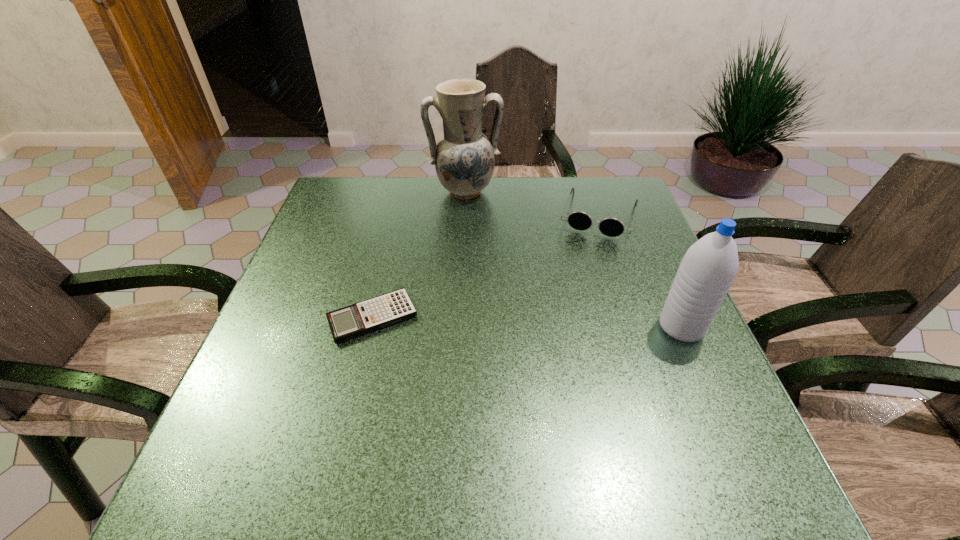
Image resolution: width=960 pixels, height=540 pixels. What are the coordinates of `vacant space that satisfies the following two spatial constraints: 1. on the front side of the pottery; 2. on the left side of the third tallest object` in the screenshot? It's located at (464, 215).